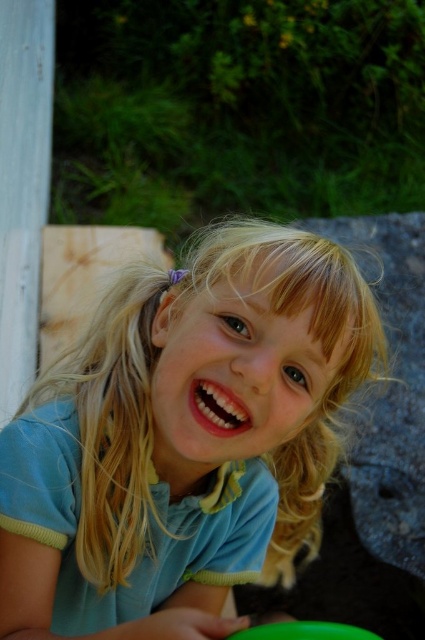
Please look at the image. There is a point marked at coordinates (183, 438). What object is located exactly at that point?

The point at coordinates (183, 438) marks the blue cotton shirt at center.

Based on the scene description, where is the blue cotton shirt at center located in terms of coordinates?

The blue cotton shirt at center is located at coordinates point (183,438).

The girl is holding an object in her hand. Which object is wider, the blue cotton shirt at center or the green plastic frisbee at lower center?

The blue cotton shirt at center is wider than the green plastic frisbee at lower center according to the description.